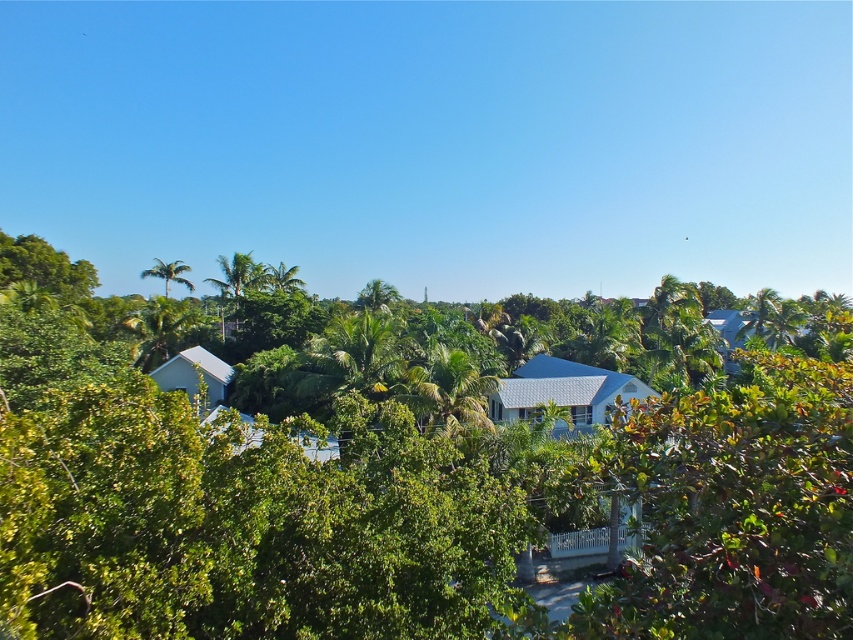
From the picture: You are a landscape architect designing a new park. You have to decide where to plant a new tree. You see the green leafy tree at center and the green leafy palm tree at upper left in the image. Which tree has a wider canopy for shade?

The green leafy tree at center has a wider canopy than the green leafy palm tree at upper left, so it provides more shade.

In the suburban landscape, there are two trees visible in the image. One is the green leafy tree at center and the other is the green leafy palm tree at upper left. Which tree is located to the right of the other?

The green leafy tree at center is positioned on the right side of green leafy palm tree at upper left.

You are standing at the point marked by the coordinates point (405, 506) in the image. What do you see directly in front of you?

The point (405, 506) indicates a green leafy tree at center, so you would see the green leafy tree directly in front of you.